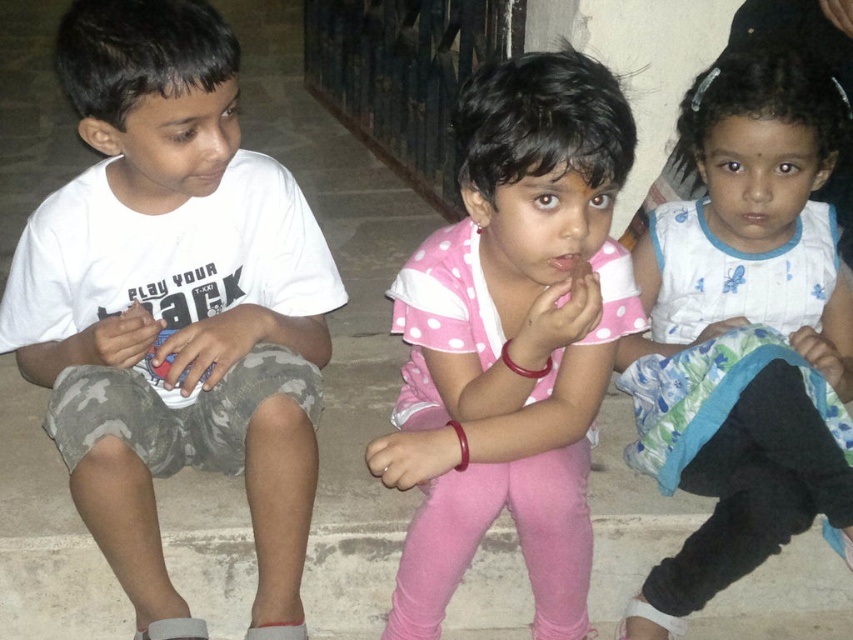
Is white cotton shirt at left wider than white dotted fabric at center?

Yes.

What do you see at coordinates (173, 305) in the screenshot?
I see `white cotton shirt at left` at bounding box center [173, 305].

Where is `white cotton shirt at left`? The image size is (853, 640). white cotton shirt at left is located at coordinates (173, 305).

Is point (612, 244) in front of point (830, 272)?

Yes, point (612, 244) is closer to viewer.

Find the location of `pink polka dot shirt at center`. pink polka dot shirt at center is located at coordinates click(512, 339).

Between white cotton shirt at left and pink polka dot shirt at center, which one appears on the right side from the viewer's perspective?

Positioned to the right is pink polka dot shirt at center.

Image resolution: width=853 pixels, height=640 pixels. Identify the location of white cotton shirt at left. (173, 305).

Locate an element on the screen. The height and width of the screenshot is (640, 853). white cotton shirt at left is located at coordinates (173, 305).